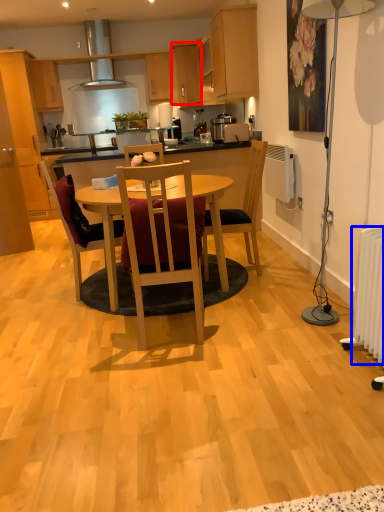
Question: Among these objects, which one is farthest to the camera, cabinetry (highlighted by a red box) or radiator (highlighted by a blue box)?

Choices:
 (A) cabinetry
 (B) radiator

Answer: (A)